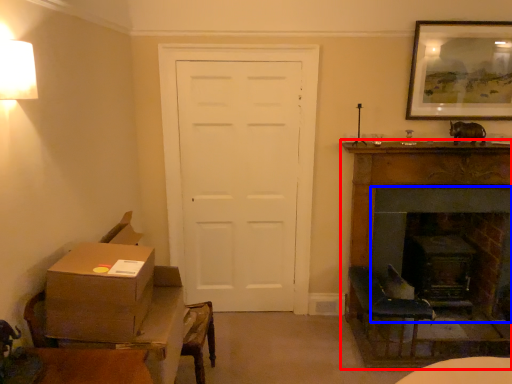
Question: Which point is closer to the camera, fireplace (highlighted by a red box) or fireplace (highlighted by a blue box)?

Choices:
 (A) fireplace
 (B) fireplace

Answer: (A)